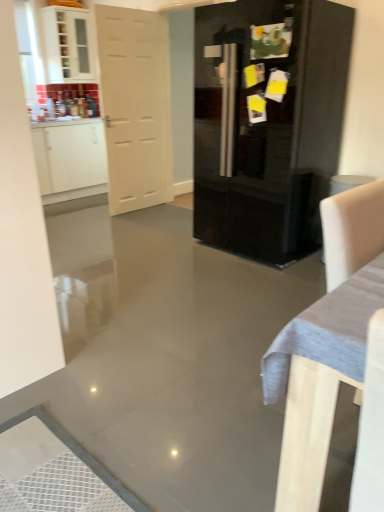
The height and width of the screenshot is (512, 384). Find the location of `glossy black refrigerator at center`. glossy black refrigerator at center is located at coordinates (267, 123).

Measure the distance between white matte door at left and camera.

white matte door at left is 3.74 meters from camera.

You are a GUI agent. You are given a task and a screenshot of the screen. Output one action in this format:
    pyautogui.click(x=<x>, y=<y>)
    Task: Click on the white fabric armchair at right
    
    Given the screenshot: What is the action you would take?
    pyautogui.click(x=352, y=230)

Is white glossy cabinet at upper left, the 1th cabinetry positioned from the bottom, not close to glossy black refrigerator at center?

That's right, there is a large distance between white glossy cabinet at upper left, the 1th cabinetry positioned from the bottom, and glossy black refrigerator at center.

Is white glossy cabinet at upper left, the 1th cabinetry positioned from the bottom, looking in the opposite direction of glossy black refrigerator at center?

That's not correct — white glossy cabinet at upper left, the 1th cabinetry positioned from the bottom, is not looking away from glossy black refrigerator at center.

Does point (69, 163) come behind point (307, 234)?

That is True.

Considering the sizes of white glossy cabinet at upper left, marked as the second cabinetry in a top-to-bottom arrangement, and glossy black refrigerator at center in the image, is white glossy cabinet at upper left, marked as the second cabinetry in a top-to-bottom arrangement, wider or thinner than glossy black refrigerator at center?

Clearly, white glossy cabinet at upper left, marked as the second cabinetry in a top-to-bottom arrangement, has less width compared to glossy black refrigerator at center.

In the scene shown: Which is farther from the camera, [50,31] or [379,241]?

Positioned behind is point [50,31].

From a real-world perspective, is white glossy cabinet at upper left, positioned as the second cabinetry in bottom-to-top order, located beneath white fabric armchair at right?

Actually, white glossy cabinet at upper left, positioned as the second cabinetry in bottom-to-top order, is physically above white fabric armchair at right in the real world.

From the image's perspective, which is above, white glossy cabinet at upper left, positioned as the 1th cabinetry in top-to-bottom order, or white fabric armchair at right?

From the image's view, white glossy cabinet at upper left, positioned as the 1th cabinetry in top-to-bottom order, is above.

Is white glossy cabinet at upper left, positioned as the 1th cabinetry in top-to-bottom order, to the left of white fabric armchair at right from the viewer's perspective?

Yes.

From a real-world perspective, which object stands above the other?

In real-world perspective, white glossy cabinet at upper left, marked as the second cabinetry in a top-to-bottom arrangement, is above.

Does white fabric armchair at right appear on the right side of white glossy cabinet at upper left, the 1th cabinetry positioned from the bottom?

Yes, white fabric armchair at right is to the right of white glossy cabinet at upper left, the 1th cabinetry positioned from the bottom.

From the image's perspective, which one is positioned lower, white fabric armchair at right or white glossy cabinet at upper left, marked as the second cabinetry in a top-to-bottom arrangement?

white fabric armchair at right appears lower in the image.

Is white fabric armchair at right beside white glossy cabinet at upper left, marked as the second cabinetry in a top-to-bottom arrangement?

They are not placed beside each other.

Is the surface of glossy black refrigerator at center in direct contact with white fabric armchair at right?

They are not placed beside each other.

Between glossy black refrigerator at center and white fabric armchair at right, which one appears on the right side from the viewer's perspective?

From the viewer's perspective, white fabric armchair at right appears more on the right side.

Considering their positions, is glossy black refrigerator at center located in front of or behind white fabric armchair at right?

glossy black refrigerator at center is positioned closer to the viewer than white fabric armchair at right.

Measure the distance from glossy black refrigerator at center to white fabric armchair at right.

They are 1.86 meters apart.

Is white matte door at left to the left of white glossy cabinet at upper left, marked as the second cabinetry in a top-to-bottom arrangement, from the viewer's perspective?

In fact, white matte door at left is to the right of white glossy cabinet at upper left, marked as the second cabinetry in a top-to-bottom arrangement.

From a real-world perspective, who is located lower, white matte door at left or white glossy cabinet at upper left, marked as the second cabinetry in a top-to-bottom arrangement?

In real-world perspective, white glossy cabinet at upper left, marked as the second cabinetry in a top-to-bottom arrangement, is lower.

Is white matte door at left turned away from white glossy cabinet at upper left, the 1th cabinetry positioned from the bottom?

Yes, white matte door at left is facing away from white glossy cabinet at upper left, the 1th cabinetry positioned from the bottom.

Is there a large distance between white matte door at left and white glossy cabinet at upper left, the 1th cabinetry positioned from the bottom?

No, white matte door at left is in close proximity to white glossy cabinet at upper left, the 1th cabinetry positioned from the bottom.

Which is in front, point (41, 193) or point (373, 255)?

The point (373, 255) is more forward.

Which of these two, white glossy cabinet at upper left, marked as the second cabinetry in a top-to-bottom arrangement, or white fabric armchair at right, is smaller?

white fabric armchair at right.

Considering the positions of objects white glossy cabinet at upper left, the 1th cabinetry positioned from the bottom, and white fabric armchair at right in the image provided, who is behind, white glossy cabinet at upper left, the 1th cabinetry positioned from the bottom, or white fabric armchair at right?

white glossy cabinet at upper left, the 1th cabinetry positioned from the bottom, is more distant.

How many degrees apart are the facing directions of white glossy cabinet at upper left, the 1th cabinetry positioned from the bottom, and white fabric armchair at right?

The angle between the facing direction of white glossy cabinet at upper left, the 1th cabinetry positioned from the bottom, and the facing direction of white fabric armchair at right is 90 degrees.

Which is correct: white glossy cabinet at upper left, positioned as the 1th cabinetry in top-to-bottom order, is inside white matte door at left, or outside of it?

white glossy cabinet at upper left, positioned as the 1th cabinetry in top-to-bottom order, is not inside white matte door at left, it's outside.

Is white glossy cabinet at upper left, positioned as the second cabinetry in bottom-to-top order, bigger than white matte door at left?

Incorrect, white glossy cabinet at upper left, positioned as the second cabinetry in bottom-to-top order, is not larger than white matte door at left.

From the image's perspective, is white glossy cabinet at upper left, positioned as the second cabinetry in bottom-to-top order, above or below white matte door at left?

From the image's perspective, white glossy cabinet at upper left, positioned as the second cabinetry in bottom-to-top order, appears above white matte door at left.

Can you tell me how much white glossy cabinet at upper left, positioned as the 1th cabinetry in top-to-bottom order, and white matte door at left differ in facing direction?

They differ by 2.49 degrees in their facing directions.

Locate an element on the screen. cupboard in front of the white glossy cabinet at upper left, marked as the second cabinetry in a top-to-bottom arrangement is located at coordinates (x=267, y=123).

Identify the location of cabinetry that is the 2nd one when counting backward from the white fabric armchair at right. This screenshot has width=384, height=512. click(x=69, y=45).

Based on their spatial positions, is white glossy cabinet at upper left, positioned as the second cabinetry in bottom-to-top order, or glossy black refrigerator at center further from white matte door at left?

Based on the image, white glossy cabinet at upper left, positioned as the second cabinetry in bottom-to-top order, appears to be further to white matte door at left.

Looking at this image, based on their spatial positions, is glossy black refrigerator at center or white fabric armchair at right closer to white glossy cabinet at upper left, positioned as the 1th cabinetry in top-to-bottom order?

glossy black refrigerator at center is closer to white glossy cabinet at upper left, positioned as the 1th cabinetry in top-to-bottom order.

Looking at this image, from the image, which object appears to be farther from glossy black refrigerator at center, white matte door at left or white glossy cabinet at upper left, the 1th cabinetry positioned from the bottom?

white glossy cabinet at upper left, the 1th cabinetry positioned from the bottom, lies further to glossy black refrigerator at center than the other object.

Looking at the image, which one is located further to white glossy cabinet at upper left, marked as the second cabinetry in a top-to-bottom arrangement, white matte door at left or glossy black refrigerator at center?

Based on the image, glossy black refrigerator at center appears to be further to white glossy cabinet at upper left, marked as the second cabinetry in a top-to-bottom arrangement.

When comparing their distances from white fabric armchair at right, does white matte door at left or white glossy cabinet at upper left, the 1th cabinetry positioned from the bottom, seem further?

white glossy cabinet at upper left, the 1th cabinetry positioned from the bottom, is further to white fabric armchair at right.

Which object lies further to the anchor point glossy black refrigerator at center, white fabric armchair at right or white matte door at left?

white fabric armchair at right.

Estimate the real-world distances between objects in this image. Which object is further from glossy black refrigerator at center, white glossy cabinet at upper left, the 1th cabinetry positioned from the bottom, or white matte door at left?

white glossy cabinet at upper left, the 1th cabinetry positioned from the bottom.

Estimate the real-world distances between objects in this image. Which object is further from white glossy cabinet at upper left, positioned as the second cabinetry in bottom-to-top order, glossy black refrigerator at center or white glossy cabinet at upper left, the 1th cabinetry positioned from the bottom?

glossy black refrigerator at center is further to white glossy cabinet at upper left, positioned as the second cabinetry in bottom-to-top order.

Locate an element on the screen. This screenshot has height=512, width=384. cabinetry positioned between glossy black refrigerator at center and white glossy cabinet at upper left, positioned as the second cabinetry in bottom-to-top order, from near to far is located at coordinates (70, 159).

You are a GUI agent. You are given a task and a screenshot of the screen. Output one action in this format:
    pyautogui.click(x=<x>, y=<y>)
    Task: Click on the cupboard between white glossy cabinet at upper left, positioned as the 1th cabinetry in top-to-bottom order, and white fabric armchair at right
    The image size is (384, 512).
    Given the screenshot: What is the action you would take?
    pyautogui.click(x=267, y=123)

In order to click on door between white glossy cabinet at upper left, marked as the second cabinetry in a top-to-bottom arrangement, and white fabric armchair at right in this screenshot , I will do `click(135, 106)`.

You are a GUI agent. You are given a task and a screenshot of the screen. Output one action in this format:
    pyautogui.click(x=<x>, y=<y>)
    Task: Click on the cupboard situated between white glossy cabinet at upper left, the 1th cabinetry positioned from the bottom, and white fabric armchair at right from left to right
    The width and height of the screenshot is (384, 512).
    Given the screenshot: What is the action you would take?
    pyautogui.click(x=267, y=123)